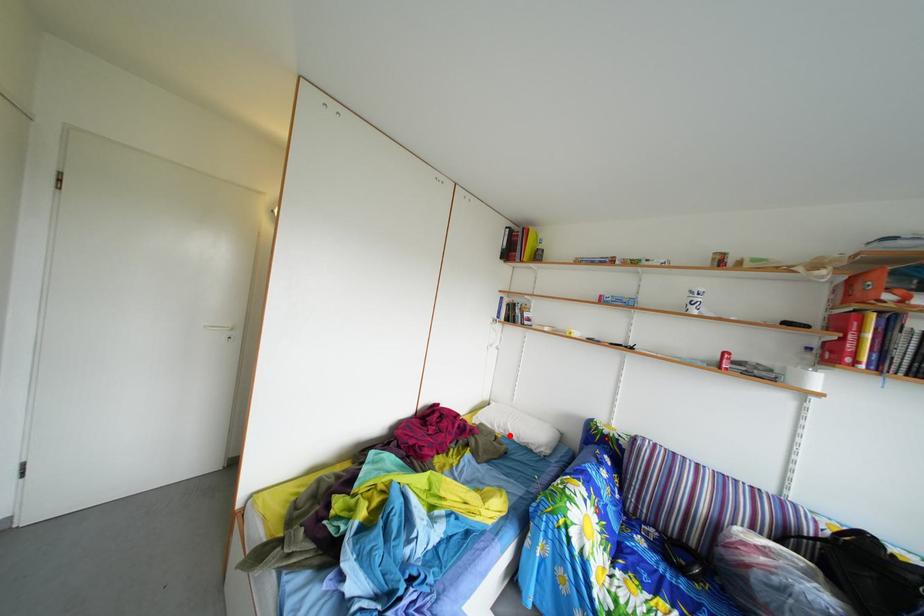
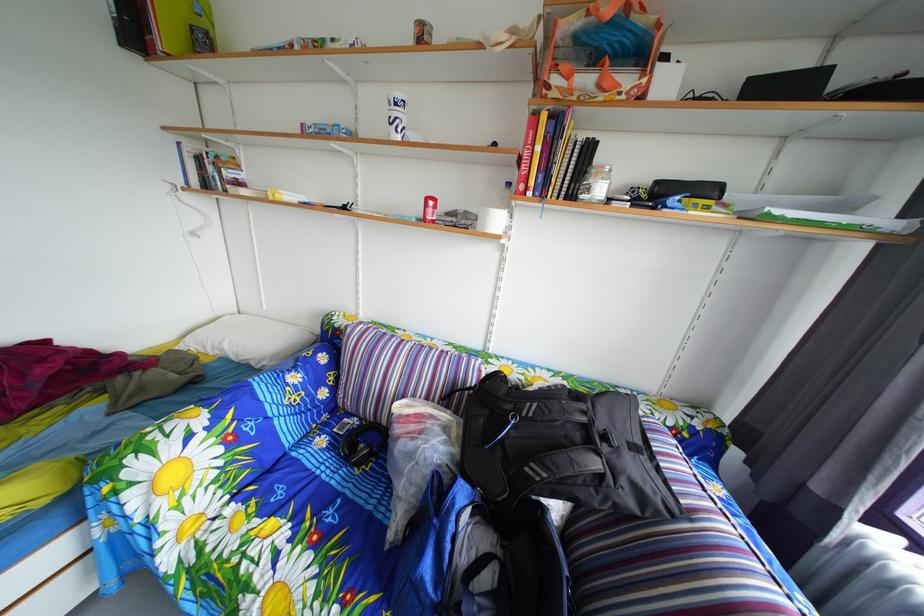
Question: I am providing you with two images of the same scene from different viewpoints. A red point is marked on the first image. Is the red point's position out of view in image 2?

Choices:
 (A) Yes
 (B) No

Answer: (B)